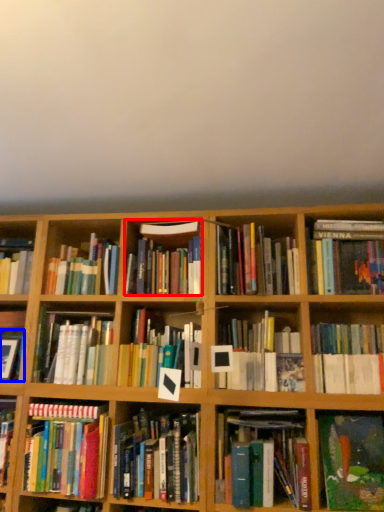
Question: Among these objects, which one is farthest to the camera, book (highlighted by a red box) or book (highlighted by a blue box)?

Choices:
 (A) book
 (B) book

Answer: (B)